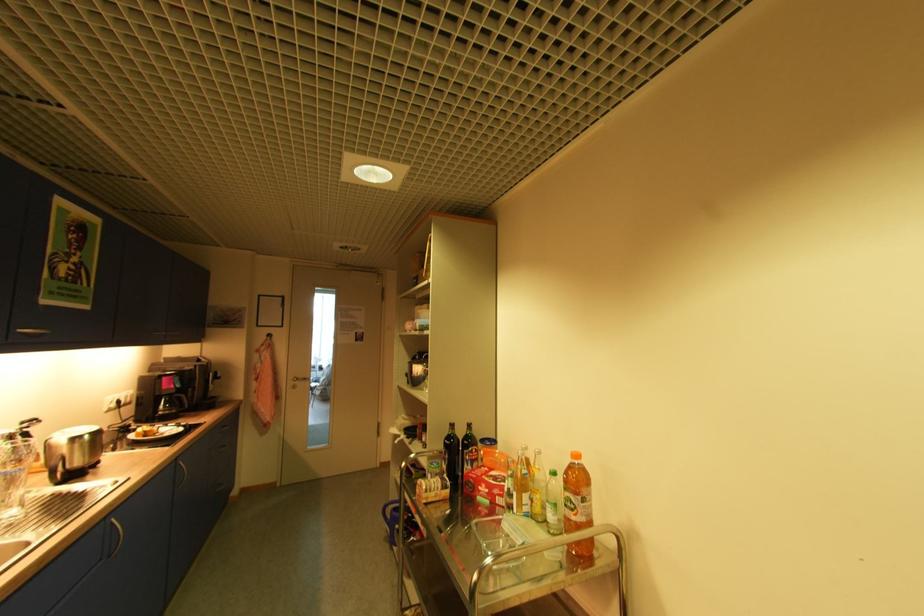
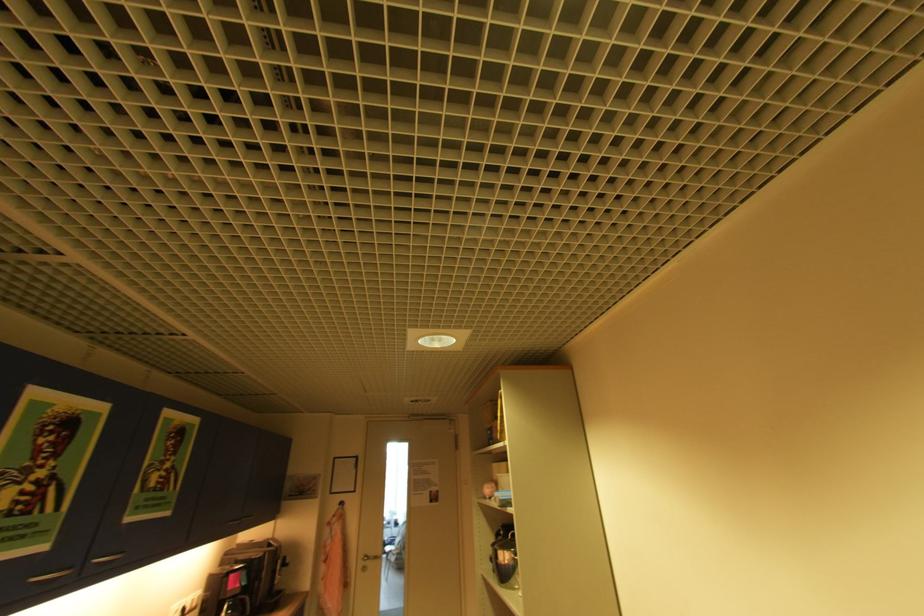
Question: How did the camera likely rotate?

Choices:
 (A) Left
 (B) Right
 (C) Up
 (D) Down

Answer: (C)